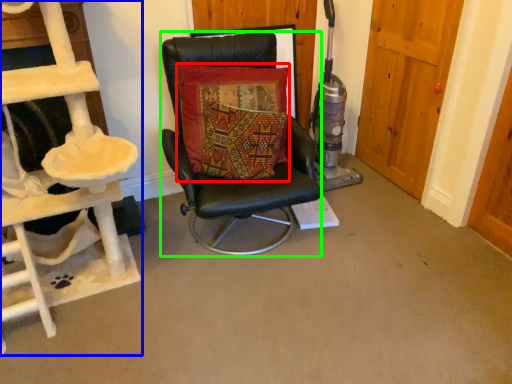
Question: Estimate the real-world distances between objects in this image. Which object is closer to pillow (highlighted by a red box), ladder (highlighted by a blue box) or chair (highlighted by a green box)?

Choices:
 (A) ladder
 (B) chair

Answer: (B)